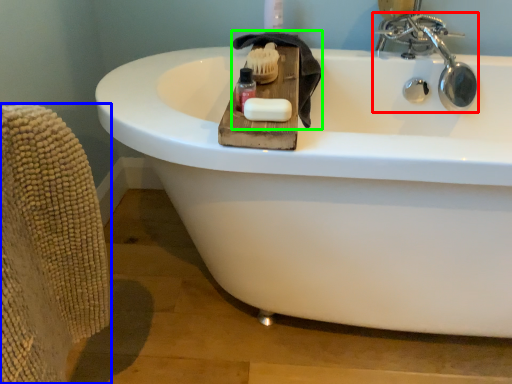
Question: Based on their relative distances, which object is nearer to tap (highlighted by a red box)? Choose from armchair (highlighted by a blue box) and bath towel (highlighted by a green box).

Choices:
 (A) armchair
 (B) bath towel

Answer: (B)